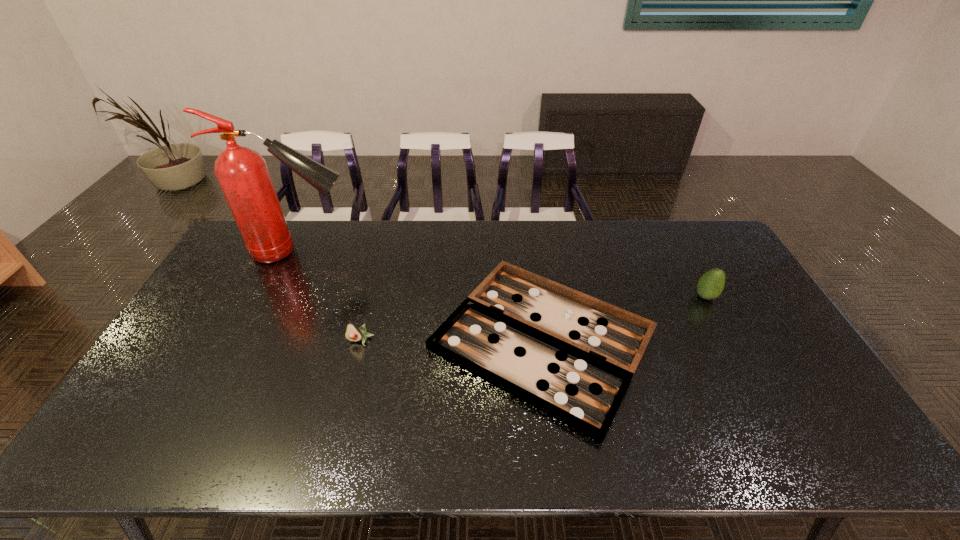
Identify the location of vacant area located 0.320m on the seed side of the second shortest object. (331, 455).

This screenshot has height=540, width=960. I want to click on vacant space located on the right of the gameboard, so click(x=721, y=340).

Find the location of `object that is at the far edge`. object that is at the far edge is located at coordinates (242, 173).

Locate an element on the screen. The image size is (960, 540). object situated at the near edge is located at coordinates (572, 356).

The height and width of the screenshot is (540, 960). What are the coordinates of `object present at the left edge` in the screenshot? It's located at (242, 173).

At what (x,y) coordinates should I click in order to perform the action: click on object present at the right edge. Please return your answer as a coordinate pair (x, y). This screenshot has height=540, width=960. Looking at the image, I should click on (710, 285).

Identify the location of object located at the far left corner. The image size is (960, 540). [242, 173].

The height and width of the screenshot is (540, 960). I want to click on free space at the far edge, so click(x=570, y=246).

Where is `vacant space at the near edge`? vacant space at the near edge is located at coordinates (787, 457).

The image size is (960, 540). I want to click on free space at the right edge, so (x=800, y=369).